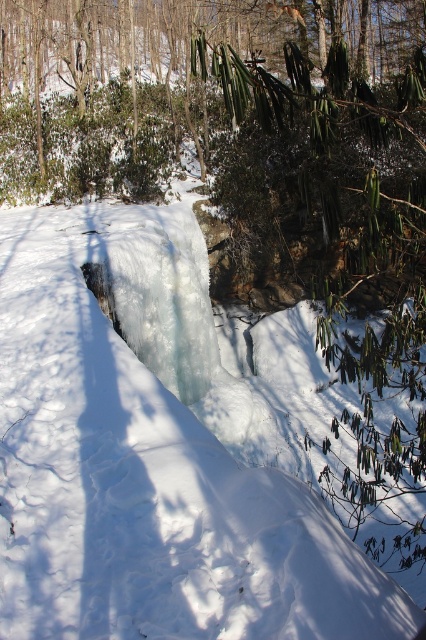
Question: Can you confirm if white frosty snow at center is positioned to the right of green leafy shrub at center?

Choices:
 (A) yes
 (B) no

Answer: (A)

Question: Which object is farther from the camera taking this photo?

Choices:
 (A) white frosty snow at center
 (B) green leafy shrub at center

Answer: (B)

Question: From the image, what is the correct spatial relationship of white frosty snow at center in relation to green leafy shrub at center?

Choices:
 (A) left
 (B) right

Answer: (B)

Question: Which object appears farthest from the camera in this image?

Choices:
 (A) white frosty snow at center
 (B) green leafy shrub at center

Answer: (B)

Question: Is white frosty snow at center in front of green leafy shrub at center?

Choices:
 (A) no
 (B) yes

Answer: (B)